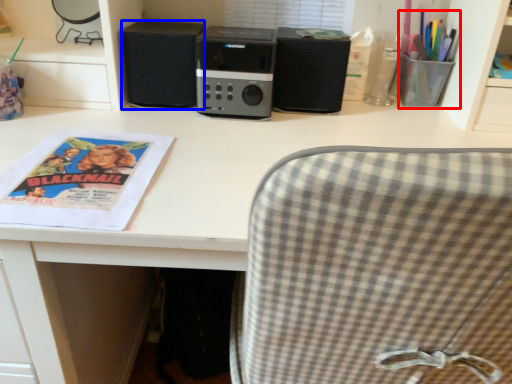
Question: Which object appears closest to the camera in this image, stationery (highlighted by a red box) or speaker (highlighted by a blue box)?

Choices:
 (A) stationery
 (B) speaker

Answer: (A)